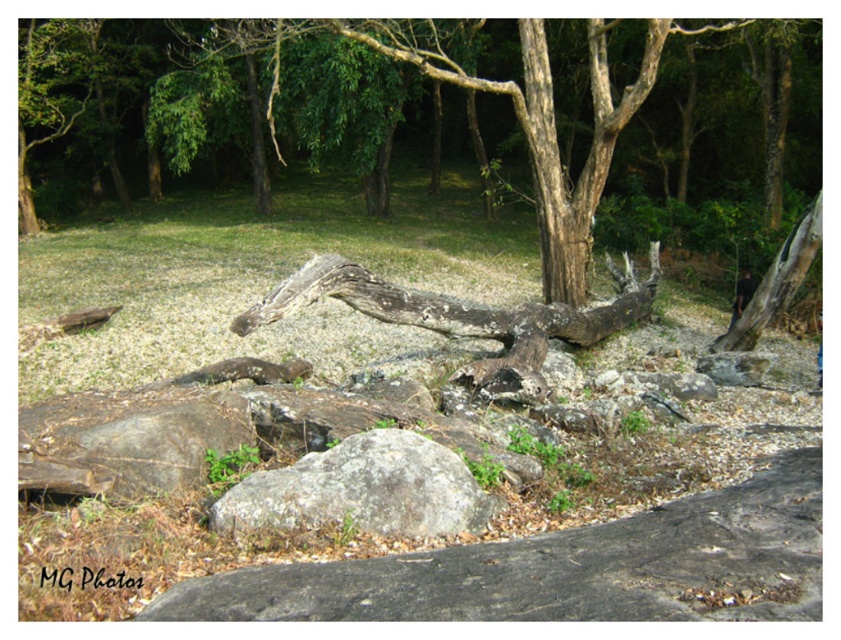
Can you confirm if gray rough rock at center is bigger than weathered wood log at center?

Actually, gray rough rock at center might be smaller than weathered wood log at center.

Which is more to the right, gray rough rock at center or weathered wood log at center?

From the viewer's perspective, weathered wood log at center appears more on the right side.

Describe the element at coordinates (362, 490) in the screenshot. This screenshot has height=640, width=841. I see `gray rough rock at center` at that location.

Where is `gray rough rock at center`? The height and width of the screenshot is (640, 841). gray rough rock at center is located at coordinates (362, 490).